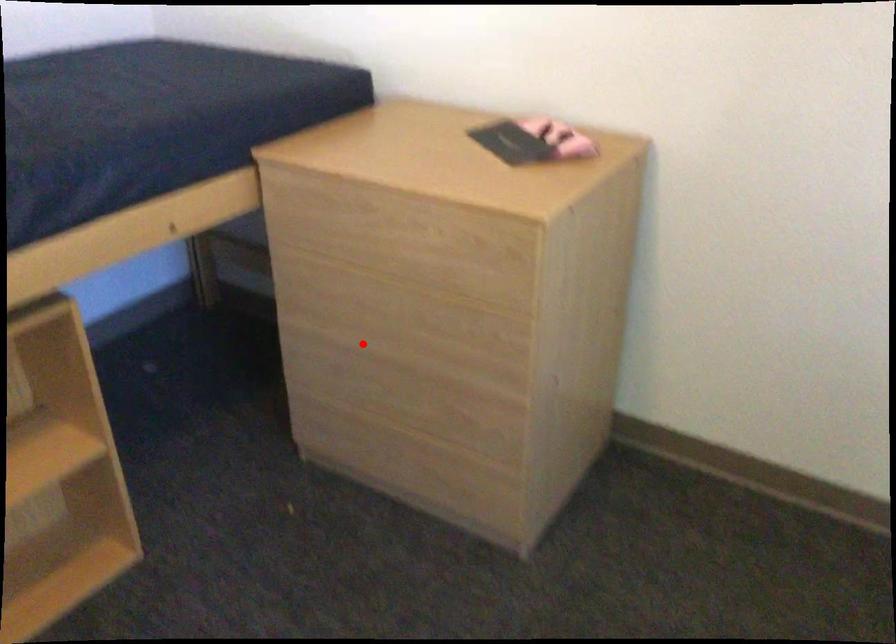
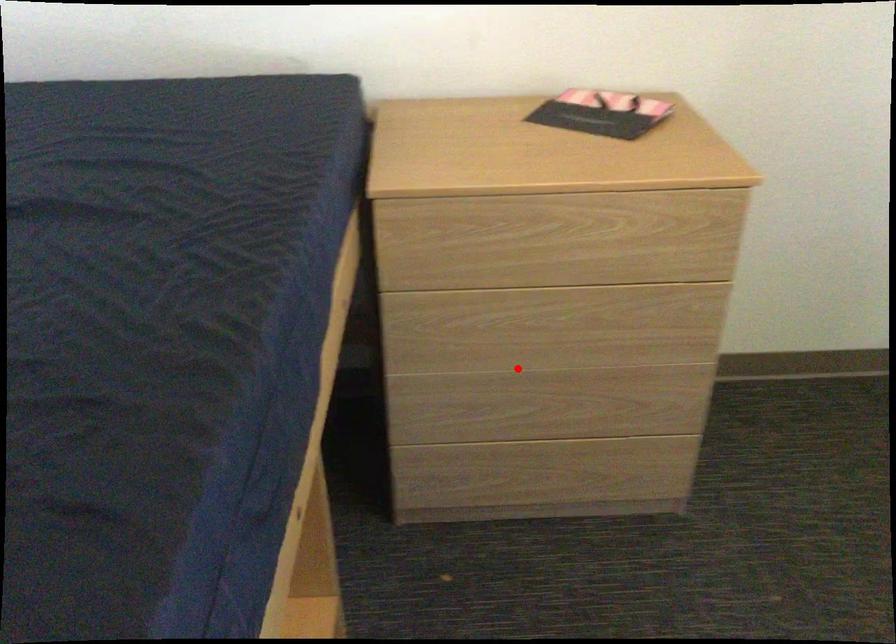
I am providing you with two images of the same scene from different viewpoints. A red point is marked on the first image and another point is marked on the second image. Do the highlighted points in image1 and image2 indicate the same real-world spot?

Yes